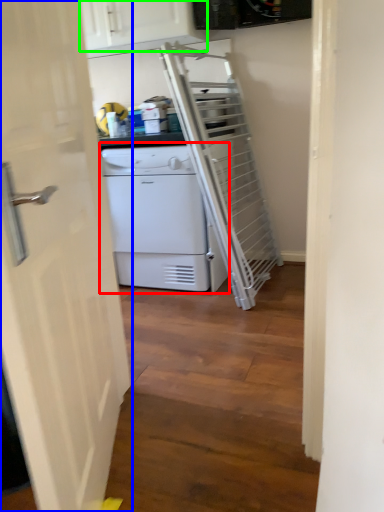
Question: Estimate the real-world distances between objects in this image. Which object is closer to home appliance (highlighted by a red box), door (highlighted by a blue box) or cabinetry (highlighted by a green box)?

Choices:
 (A) door
 (B) cabinetry

Answer: (B)